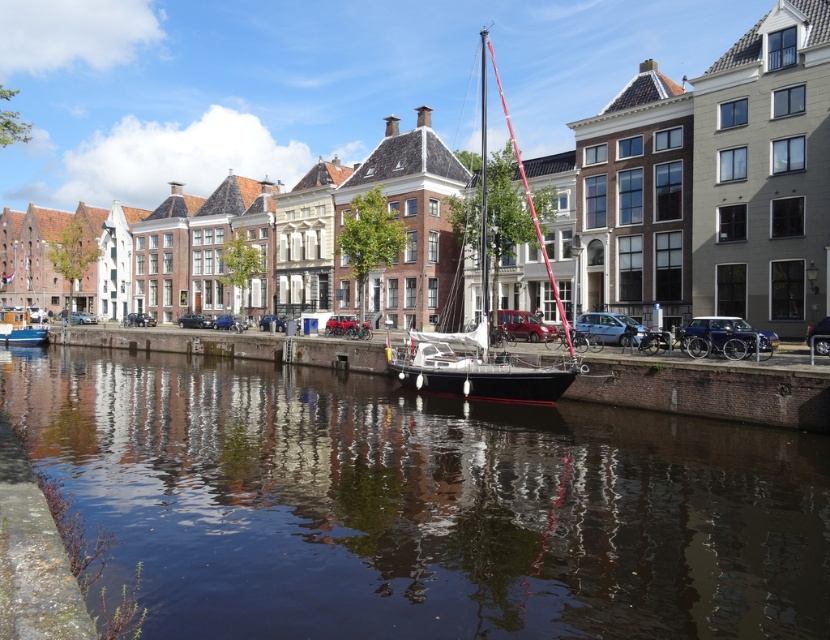
Can you confirm if smooth dark water at center is smaller than white sailboat at center?

Correct, smooth dark water at center occupies less space than white sailboat at center.

Who is more distant from viewer, (828, 520) or (481, 240)?

The point (481, 240) is more distant.

You are a GUI agent. You are given a task and a screenshot of the screen. Output one action in this format:
    pyautogui.click(x=<x>, y=<y>)
    Task: Click on the smooth dark water at center
    Image resolution: width=830 pixels, height=640 pixels.
    Given the screenshot: What is the action you would take?
    pyautogui.click(x=421, y=504)

Is point (521, 492) less distant than point (2, 333)?

Yes.

Does smooth dark water at center appear on the right side of matte blue boat at lower left?

Yes, smooth dark water at center is to the right of matte blue boat at lower left.

Image resolution: width=830 pixels, height=640 pixels. What are the coordinates of `smooth dark water at center` in the screenshot? It's located at (421, 504).

Is point (531, 212) positioned behind point (7, 314)?

No, it is in front of (7, 314).

Is white sailboat at center smaller than matte blue boat at lower left?

No.

Where is `white sailboat at center`? white sailboat at center is located at coordinates (479, 259).